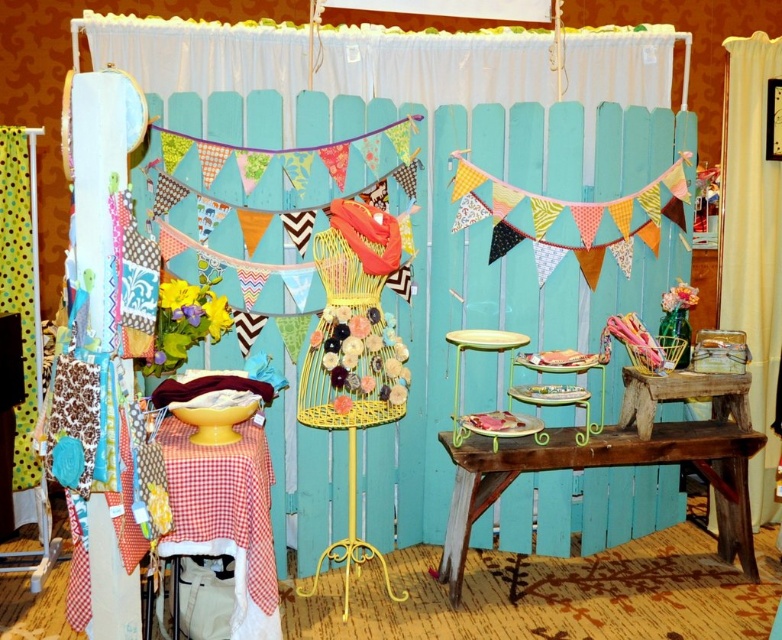
Please provide the coordinates of the rustic wood table at center in the image.

The rustic wood table at center is located at coordinates point (x=601, y=467).

You are setting up for an event and need to place a 15 cm wide decoration between the rustic wood table at center and the rustic wood table at lower right. Can you fit it without overlapping either table?

The distance between the rustic wood table at center and rustic wood table at lower right is 20.02 centimeters. Since the decoration is 15 cm wide, there is enough space to place it between them without overlapping either table.

You are standing in front of the craft fair display and want to place a new item on the nearest rustic wood table. Which one should you choose between the rustic wood table at center and the rustic wood table at lower right?

The rustic wood table at center is closer to the viewer, so you should choose the rustic wood table at center to place your new item.